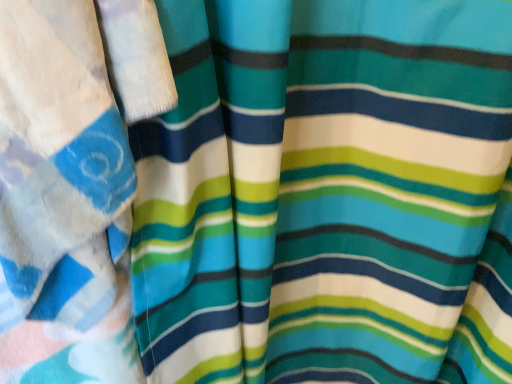
Where is `matte fabric curtain at left`? This screenshot has width=512, height=384. matte fabric curtain at left is located at coordinates (71, 183).

What do you see at coordinates (71, 183) in the screenshot? Image resolution: width=512 pixels, height=384 pixels. I see `matte fabric curtain at left` at bounding box center [71, 183].

This screenshot has height=384, width=512. What are the coordinates of `matte fabric curtain at left` in the screenshot? It's located at (71, 183).